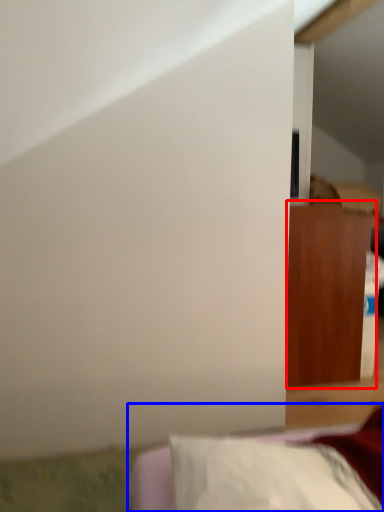
Question: Which object appears closest to the camera in this image, furniture (highlighted by a red box) or furniture (highlighted by a blue box)?

Choices:
 (A) furniture
 (B) furniture

Answer: (B)